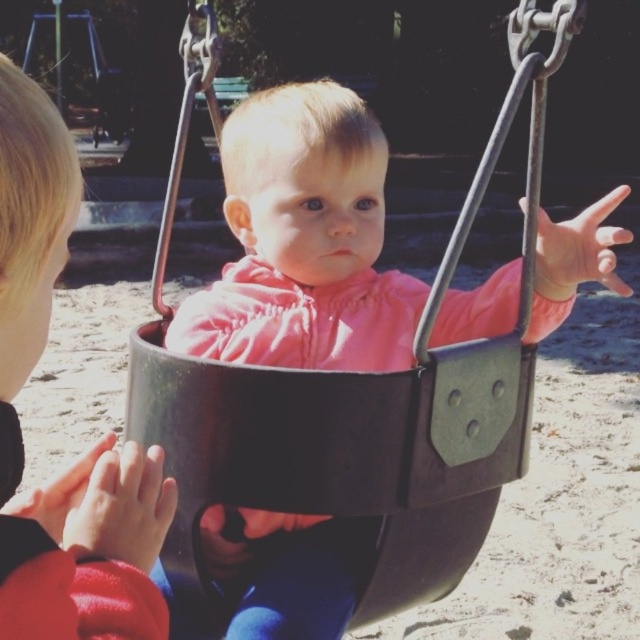
What is the location of the point with coordinates (365, 412) in the playground scene?

The point with coordinates (365, 412) is located on the black matte swing at center.

You are a parent at the playground and want to ensure your baby is safe. You see the black matte swing at center and the matte black swing at center. Which swing is positioned to the right side of the other?

The black matte swing at center is positioned to the right of the matte black swing at center.